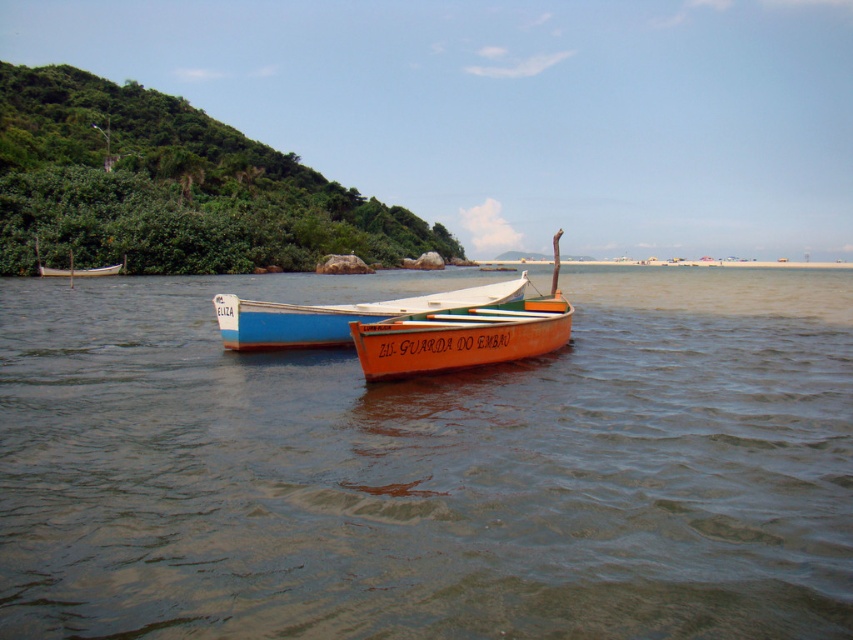
This screenshot has width=853, height=640. Describe the element at coordinates (335, 316) in the screenshot. I see `blue painted wood boat at center` at that location.

Does blue painted wood boat at center come in front of white wooden boat at left?

Yes, it is in front of white wooden boat at left.

Who is more distant from viewer, (306, 346) or (123, 269)?

The point (123, 269) is more distant.

Locate an element on the screen. The width and height of the screenshot is (853, 640). blue painted wood boat at center is located at coordinates (335, 316).

Can you confirm if brown matte water at center is shorter than blue painted wood boat at center?

No, brown matte water at center is not shorter than blue painted wood boat at center.

Looking at this image, can you confirm if brown matte water at center is thinner than blue painted wood boat at center?

Incorrect, brown matte water at center's width is not less than blue painted wood boat at center's.

Image resolution: width=853 pixels, height=640 pixels. What are the coordinates of `brown matte water at center` in the screenshot? It's located at (428, 467).

Can you confirm if brown matte water at center is positioned above white wooden boat at left?

Actually, brown matte water at center is below white wooden boat at left.

In the scene shown: Who is shorter, brown matte water at center or white wooden boat at left?

white wooden boat at left

Is point (146, 435) farther from camera compared to point (91, 268)?

No.

Where is `brown matte water at center`? This screenshot has width=853, height=640. brown matte water at center is located at coordinates (428, 467).